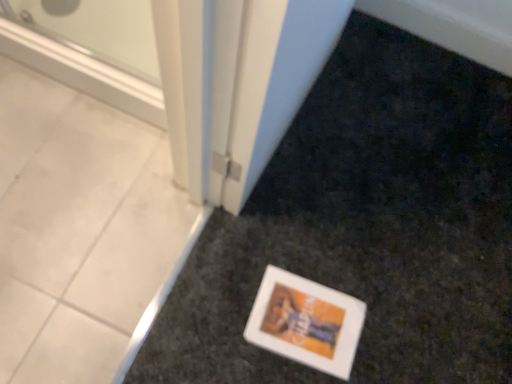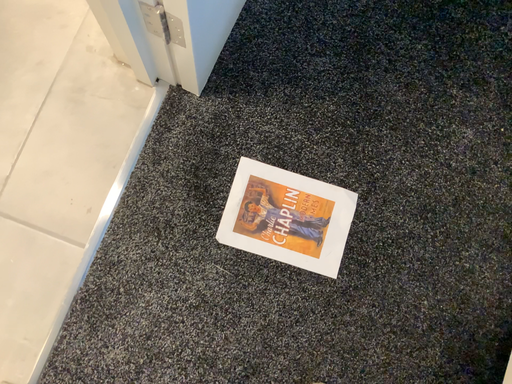
Question: Which way did the camera rotate in the video?

Choices:
 (A) rotated upward
 (B) rotated downward

Answer: (B)